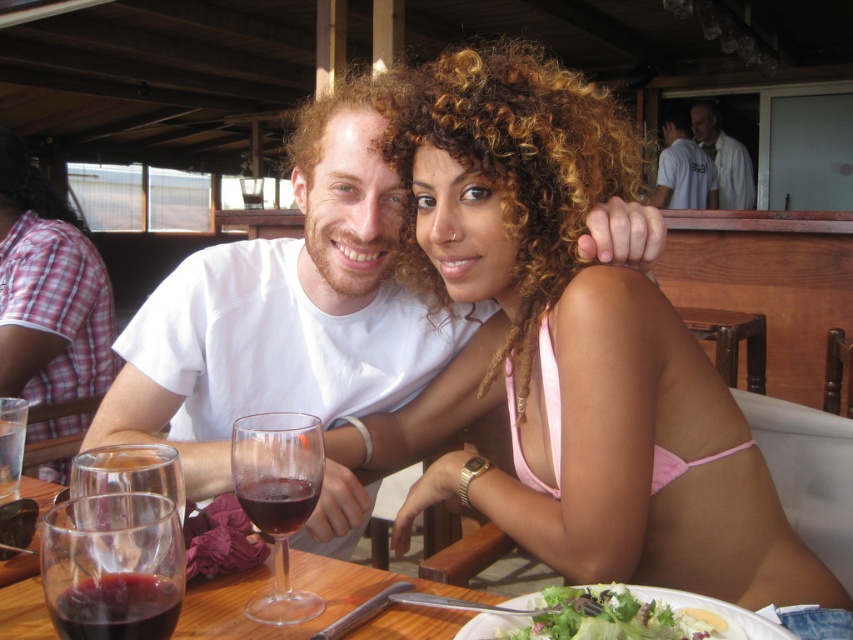
Is white cotton shirt at center shorter than green leafy salad at lower center?

No, white cotton shirt at center is not shorter than green leafy salad at lower center.

Who is positioned more to the left, white cotton shirt at center or green leafy salad at lower center?

white cotton shirt at center

Does point (337, 529) lie behind point (663, 636)?

Yes, it is behind point (663, 636).

I want to click on white cotton shirt at center, so click(286, 308).

Which of these two, transparent glass at center or pink fabric bikini top at center, stands taller?

pink fabric bikini top at center is taller.

At what (x,y) coordinates should I click in order to perform the action: click on transparent glass at center. Please return your answer as a coordinate pair (x, y). This screenshot has height=640, width=853. Looking at the image, I should click on (277, 499).

The height and width of the screenshot is (640, 853). What are the coordinates of `transparent glass at center` in the screenshot? It's located at (277, 499).

Which of these two, transparent glass at table or transparent glass at table center, stands taller?

Standing taller between the two is transparent glass at table center.

Does transparent glass at table have a lesser height compared to transparent glass at table center?

Correct, transparent glass at table is not as tall as transparent glass at table center.

Identify the location of transparent glass at table. (113, 566).

The width and height of the screenshot is (853, 640). I want to click on transparent glass at table, so coord(113,566).